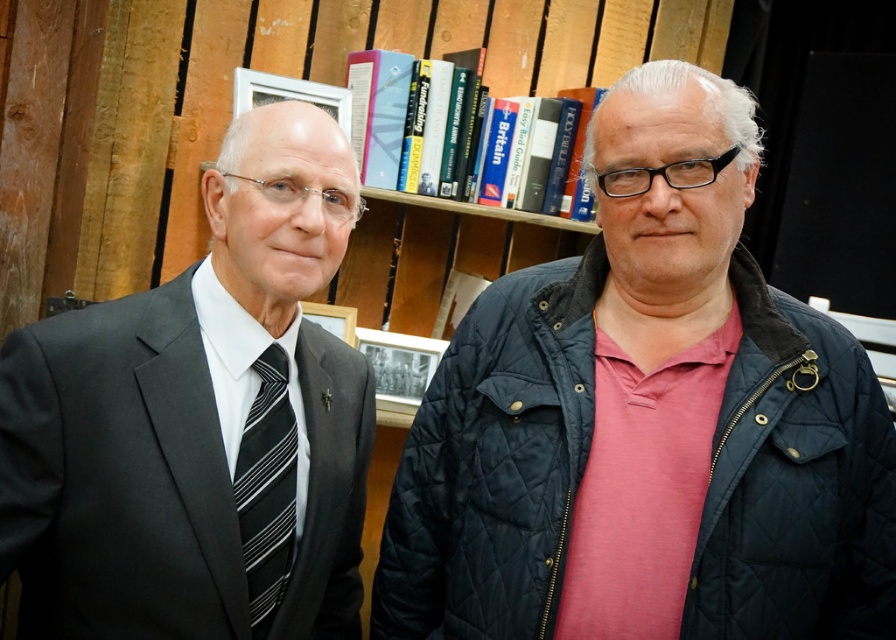
Question: Does dark blue quilted jacket at right have a lesser width compared to black striped tie at left?

Choices:
 (A) yes
 (B) no

Answer: (B)

Question: Which object is closer to the camera taking this photo?

Choices:
 (A) dark blue quilted jacket at right
 (B) black striped tie at left

Answer: (B)

Question: Which point is farther to the camera?

Choices:
 (A) black striped tie at left
 (B) dark blue quilted jacket at right

Answer: (B)

Question: Is the position of matte black suit at left more distant than that of black striped tie at left?

Choices:
 (A) yes
 (B) no

Answer: (B)

Question: Is matte black suit at left above black striped tie at left?

Choices:
 (A) yes
 (B) no

Answer: (A)

Question: Which object is positioned farthest from the dark blue quilted jacket at right?

Choices:
 (A) matte black suit at left
 (B) black striped tie at left

Answer: (B)